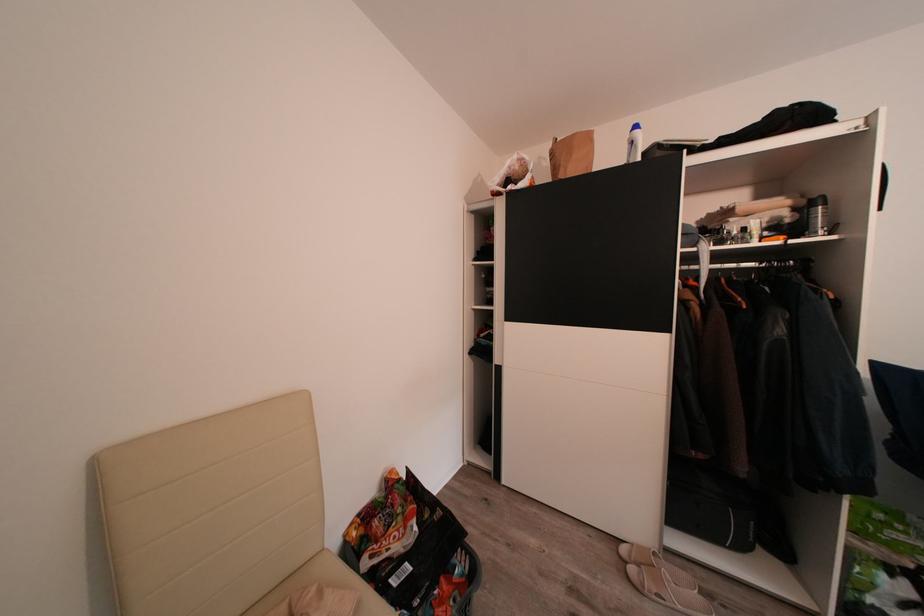
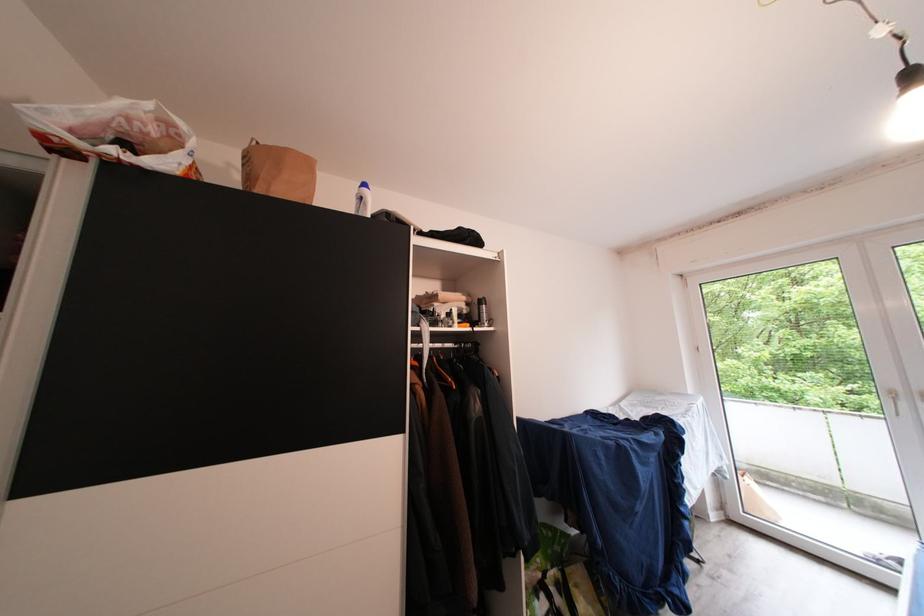
Question: The camera is either moving clockwise (left) or counter-clockwise (right) around the object. The first image is from the beginning of the video and the second image is from the end. Is the camera moving left or right when shooting the video?

Choices:
 (A) Left
 (B) Right

Answer: (A)